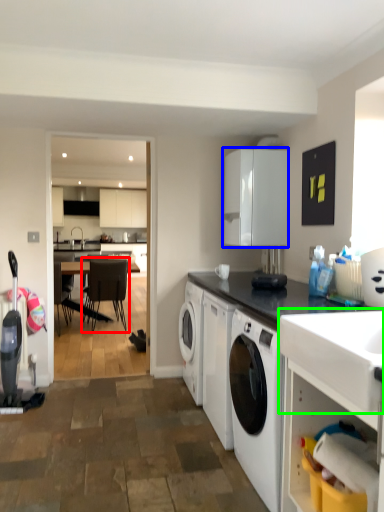
Question: Which object is the closest to the chair (highlighted by a red box)? Choose among these: cabinetry (highlighted by a blue box) or sink (highlighted by a green box).

Choices:
 (A) cabinetry
 (B) sink

Answer: (A)